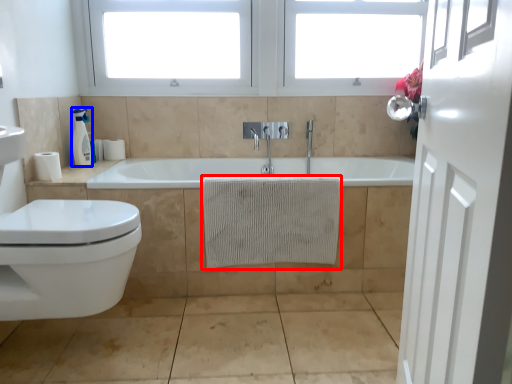
Question: Which of the following is the farthest to the observer, bath towel (highlighted by a red box) or soap dispenser (highlighted by a blue box)?

Choices:
 (A) bath towel
 (B) soap dispenser

Answer: (B)